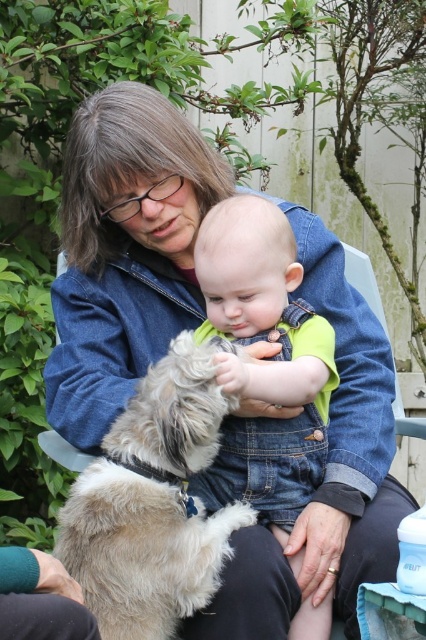
Question: Is fuzzy beige dog at center above denim overalls at center?

Choices:
 (A) no
 (B) yes

Answer: (A)

Question: From the image, what is the correct spatial relationship of fuzzy beige dog at center in relation to denim overalls at center?

Choices:
 (A) above
 (B) below

Answer: (B)

Question: Is fuzzy beige dog at center thinner than denim overalls at center?

Choices:
 (A) yes
 (B) no

Answer: (B)

Question: Which point is closer to the camera?

Choices:
 (A) denim overalls at center
 (B) fuzzy beige dog at center

Answer: (B)

Question: Which point is closer to the camera?

Choices:
 (A) fuzzy beige dog at center
 (B) denim overalls at center

Answer: (A)